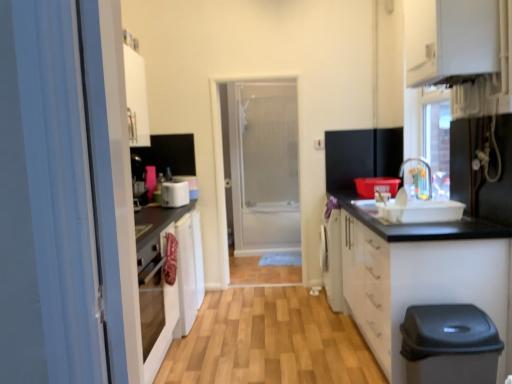
You are a GUI agent. You are given a task and a screenshot of the screen. Output one action in this format:
    pyautogui.click(x=<x>, y=<y>)
    Task: Click on the free space above wooden floor at center (from a real-world perspective)
    
    Given the screenshot: What is the action you would take?
    pyautogui.click(x=285, y=323)